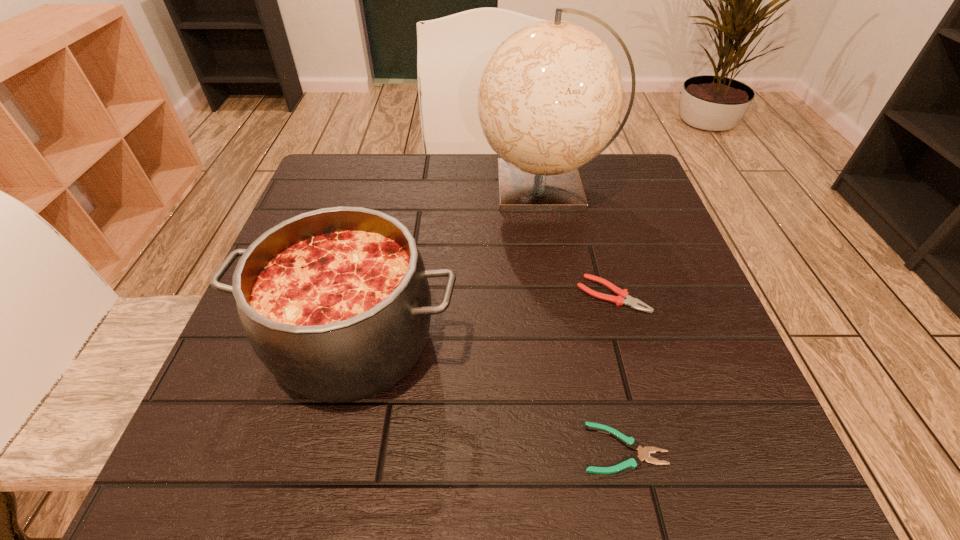
You are a GUI agent. You are given a task and a screenshot of the screen. Output one action in this format:
    pyautogui.click(x=<x>, y=<y>)
    Task: Click on the farthest object
    Image resolution: width=960 pixels, height=540 pixels.
    Given the screenshot: What is the action you would take?
    (x=550, y=97)

Image resolution: width=960 pixels, height=540 pixels. What are the coordinates of `the tallest object` in the screenshot? It's located at (550, 97).

Find the location of `the leftmost object`. the leftmost object is located at coordinates (335, 302).

At what (x,y) coordinates should I click in order to perform the action: click on casserole. Please return your answer as a coordinate pair (x, y). Looking at the image, I should click on (335, 302).

Image resolution: width=960 pixels, height=540 pixels. I want to click on the farther pliers, so click(623, 298).

Locate an element on the screen. This screenshot has height=540, width=960. the second shortest object is located at coordinates (623, 298).

At what (x,y) coordinates should I click in order to perform the action: click on the nearest object. Please return your answer as a coordinate pair (x, y). Looking at the image, I should click on (633, 461).

Locate an element on the screen. The image size is (960, 540). the shortest object is located at coordinates (633, 461).

Find the location of a particular element. The width and height of the screenshot is (960, 540). vacant space located 0.070m on the surface of the globe showing Europe and Africa is located at coordinates (447, 187).

Identify the location of free region located on the surface of the globe showing Europe and Africa. The image size is (960, 540). click(x=330, y=187).